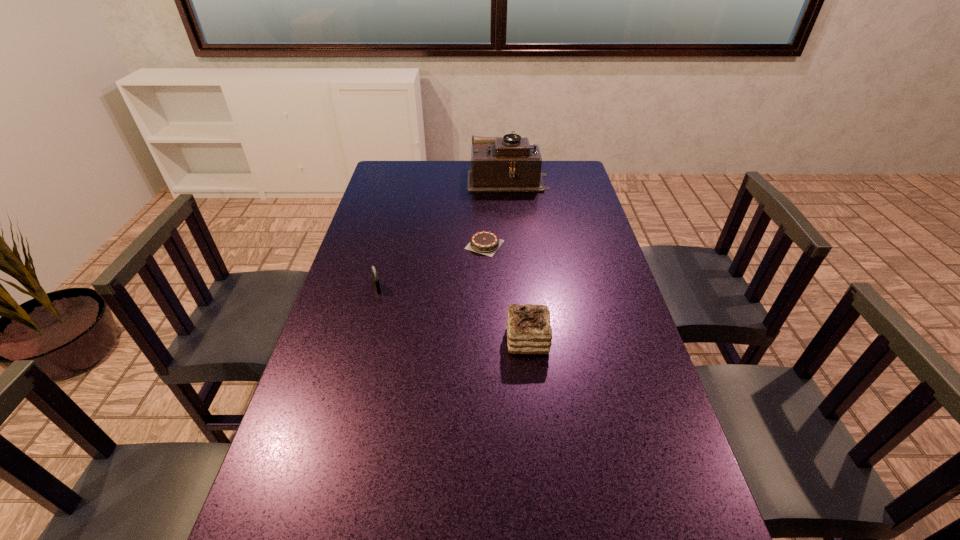
The height and width of the screenshot is (540, 960). I want to click on vacant area situated 0.160m on the horn of the phonograph_record, so click(x=429, y=178).

The image size is (960, 540). In order to click on vacant space located on the left of the nearest object in this screenshot , I will do coord(405,340).

Identify the location of vacant space situated on the front of the third tallest object. (352, 383).

You are a GUI agent. You are given a task and a screenshot of the screen. Output one action in this format:
    pyautogui.click(x=<x>, y=<y>)
    Task: Click on the vacant space located 0.140m on the right of the third nearest object
    
    Given the screenshot: What is the action you would take?
    pyautogui.click(x=546, y=245)

Find the location of a particular element. This screenshot has height=540, width=960. object that is positioned at the far edge is located at coordinates (498, 164).

Identify the location of object present at the left edge. (375, 278).

Identify the location of object that is at the right edge. The image size is (960, 540). (498, 164).

In order to click on object located in the far right corner section of the desktop in this screenshot , I will do `click(498, 164)`.

You are a GUI agent. You are given a task and a screenshot of the screen. Output one action in this format:
    pyautogui.click(x=<x>, y=<y>)
    Task: Click on the vacant region at the left edge of the desktop
    This screenshot has width=960, height=540.
    Given the screenshot: What is the action you would take?
    pyautogui.click(x=371, y=320)

Find the location of a particular element. The height and width of the screenshot is (540, 960). vacant space at the right edge of the desktop is located at coordinates (629, 310).